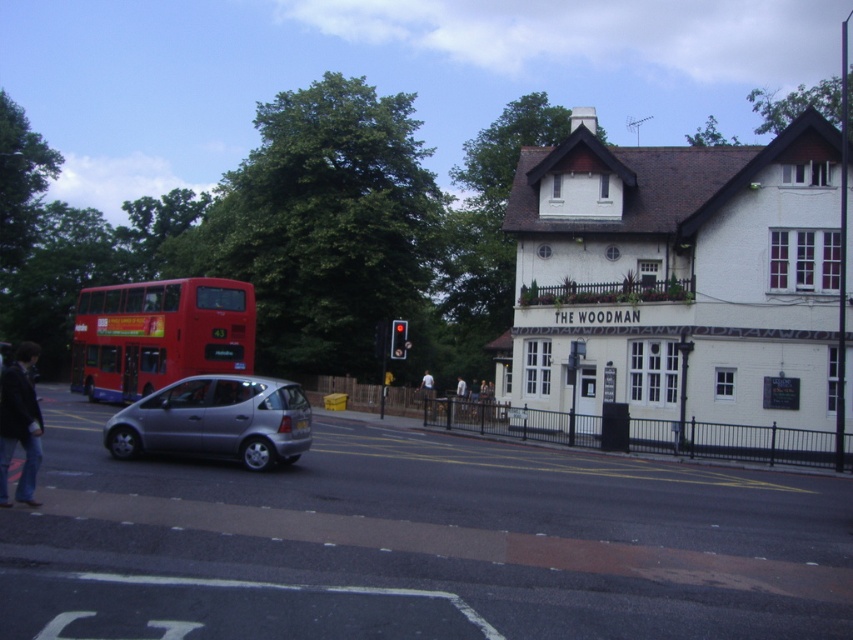
Please provide the coordinates of the silver metallic car at center in the image. The coordinates should be in the format of a point with two decimal places, such as 0.500, 0.500. The scene is a street with a white building labeled THE WOODMAN on the right, a pedestrian crossing, and a red double decker bus on the left.

The coordinates of the silver metallic car at center are (416,544).